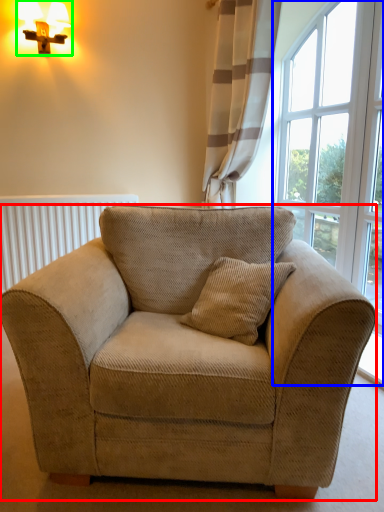
Question: Which is farther away from studio couch (highlighted by a red box)? window (highlighted by a blue box) or table lamp (highlighted by a green box)?

Choices:
 (A) window
 (B) table lamp

Answer: (B)